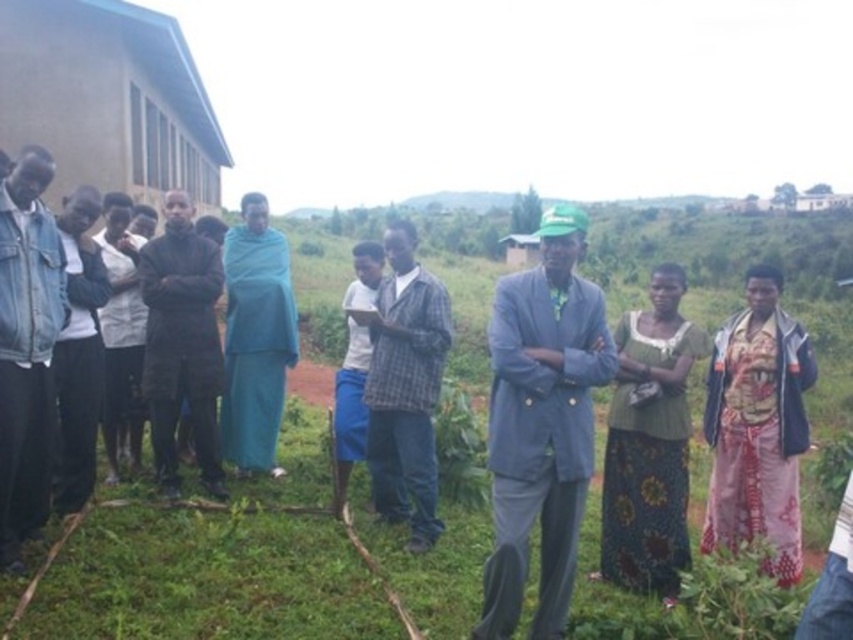
You are a photographer trying to capture a photo of the light gray suit at center. You are currently standing at point 0.0, 0.0. Which direction should you move to get a better shot?

The light gray suit at center is located at point (541, 422), so you should move towards the northeast direction to align with its position.

You are a photographer trying to capture a group photo of the light gray suit at center and the teal wrap at lower right. You want to ensure both subjects are in focus. Based on their positions, which subject should you focus on first to achieve optimal sharpness?

The light gray suit at center is positioned closer to the camera than the teal wrap at lower right. To achieve optimal sharpness, focus on the light gray suit at center first, then the teal wrap at lower right.

You are organizing a photo shoot and need to place two models wearing the light gray suit at center and the denim jacket at left. The set requires that the wider clothing item must be placed on the right side of the frame. Based on the scene description, which clothing item should be positioned on the right?

The light gray suit at center should be positioned on the right side of the frame because its width surpasses that of the denim jacket at left.